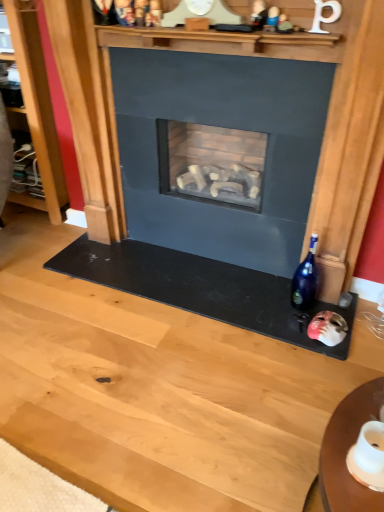
Describe the element at coordinates (305, 280) in the screenshot. I see `blue glass bottle at right` at that location.

The image size is (384, 512). Find the location of `blue glass bottle at right`. blue glass bottle at right is located at coordinates (305, 280).

Where is `blue glass bottle at right`? blue glass bottle at right is located at coordinates (305, 280).